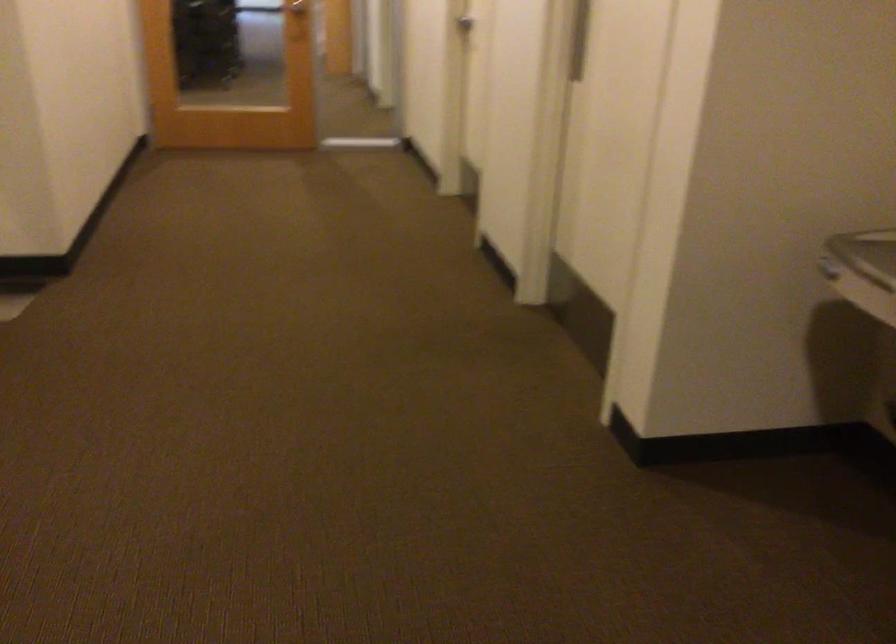
What do you see at coordinates (829, 269) in the screenshot? The image size is (896, 644). I see `the fountain push button` at bounding box center [829, 269].